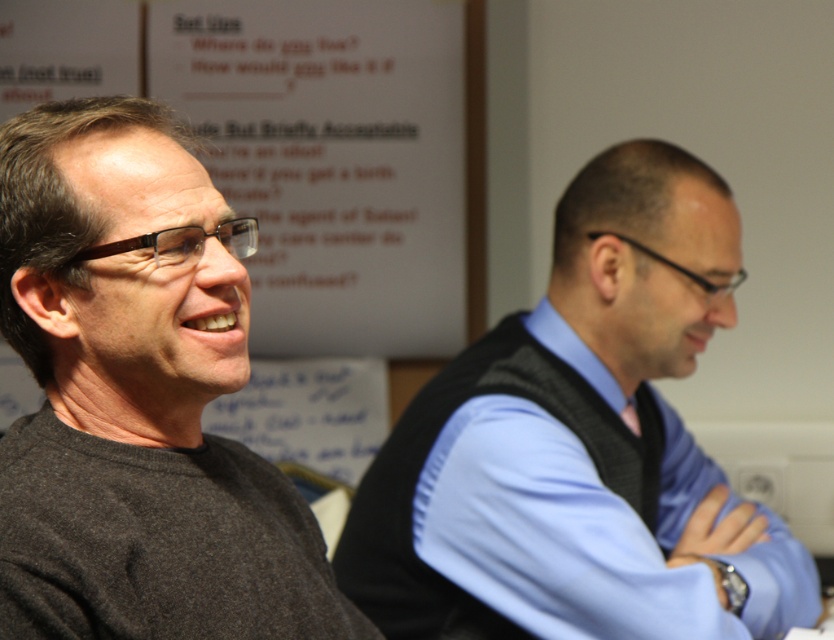
You are a photographer standing between the light blue shirt at right and the dark gray sweater at left. You want to take a photo of both subjects without moving them. Can you fit both into your camera frame if your camera has a maximum horizontal field of view of 24 inches?

The light blue shirt at right is 22.96 inches away from the dark gray sweater at left. Since the distance between them is less than the camera frame of 24 inches, you can fit both into the camera frame.

You are a photographer setting up a shoot between the light blue shirt at right and dark gray sweater at left. To ensure both subjects are in frame, should you position your camera to the left or right of the two people?

The light blue shirt at right is positioned on the right side of dark gray sweater at left. To include both in the frame, position the camera to the left of the two people so that the dark gray sweater at left is on the left side and the light blue shirt at right is on the right side.